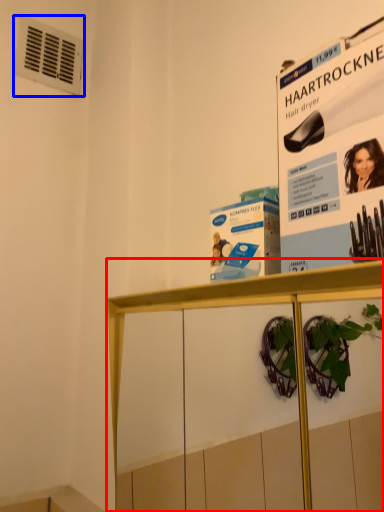
Question: Among these objects, which one is farthest to the camera, shelf (highlighted by a red box) or air conditioning (highlighted by a blue box)?

Choices:
 (A) shelf
 (B) air conditioning

Answer: (B)